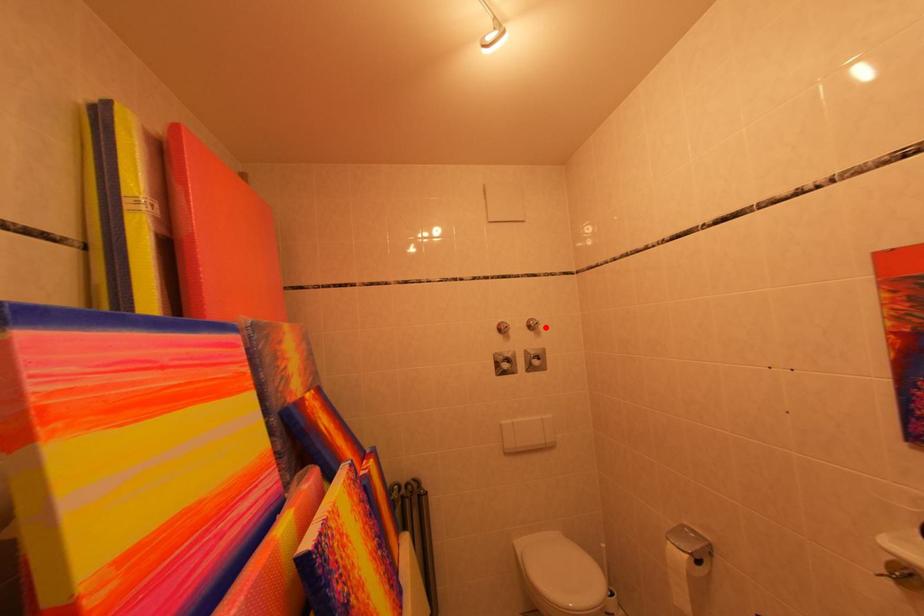
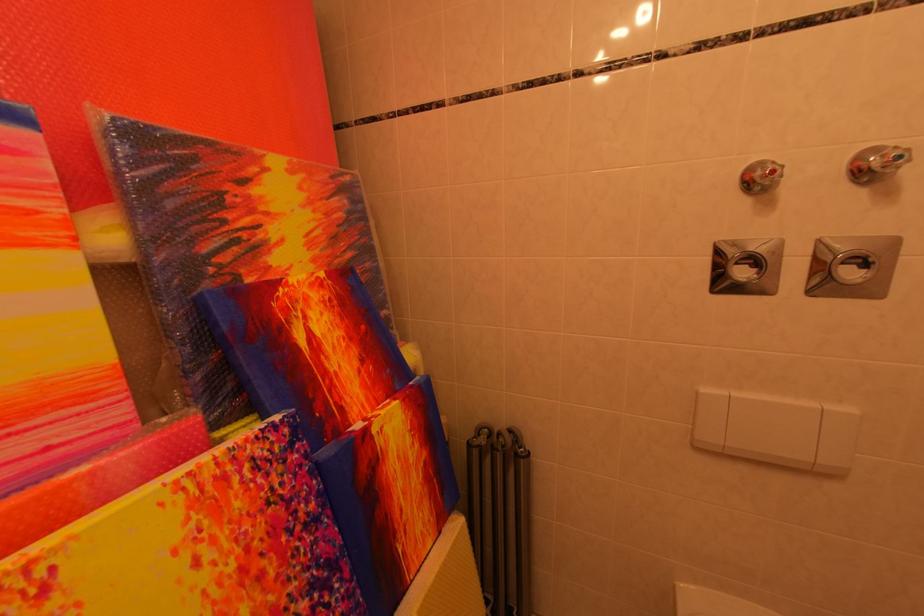
In the second image, find the point that corresponds to the highlighted location in the first image.

(907, 161)